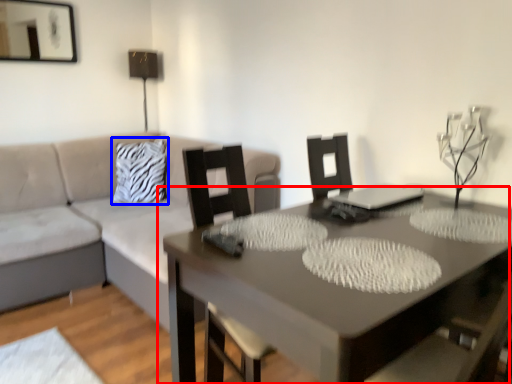
Question: Which point is closer to the camera, table (highlighted by a red box) or pillow (highlighted by a blue box)?

Choices:
 (A) table
 (B) pillow

Answer: (A)